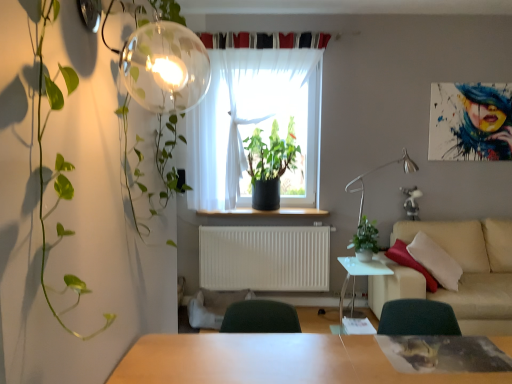
Question: From their relative heights in the image, would you say white sheer curtain at center is taller or shorter than silver metallic table lamp at right?

Choices:
 (A) tall
 (B) short

Answer: (A)

Question: From a real-world perspective, is white sheer curtain at center physically located above or below silver metallic table lamp at right?

Choices:
 (A) below
 (B) above

Answer: (B)

Question: Which object is the farthest from the beige fabric couch at right?

Choices:
 (A) white matte radiator at center
 (B) white sheer curtain at center
 (C) white glossy side table at center
 (D) transparent glass globe at upper left
 (E) green matte plant at center, positioned as the second houseplant in top-to-bottom order

Answer: (D)

Question: Estimate the real-world distances between objects in this image. Which object is farther from the green matte plant at center, the 2th houseplant positioned from the left?

Choices:
 (A) white glossy side table at center
 (B) silver metallic table lamp at right
 (C) white matte radiator at center
 (D) beige fabric couch at right
 (E) wooden at center

Answer: (C)